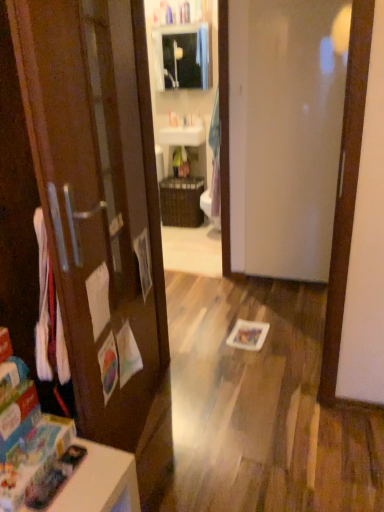
Where is `vacant space in front of white glossy door at center`? vacant space in front of white glossy door at center is located at coordinates (287, 301).